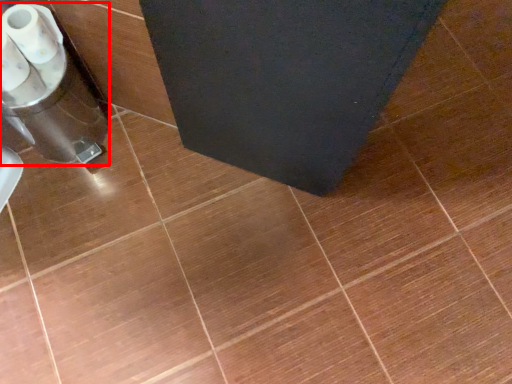
Question: Considering the relative positions of appliance (annotated by the red box) and toilet paper in the image provided, where is appliance (annotated by the red box) located with respect to the staircase?

Choices:
 (A) left
 (B) right

Answer: (A)